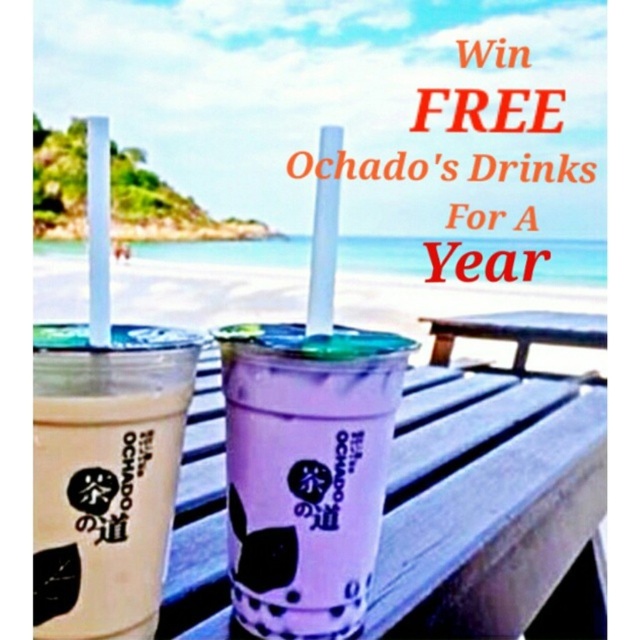
You are at a beach picnic and want to know which item is taller between the purple translucent cup at center and the wooden picnic table at center. According to the scene, which one is taller?

The purple translucent cup at center is taller than the wooden picnic table at center.

Looking at this image, you are standing in front of the wooden picnic table at center and want to grab the purple translucent cup at center. Can you reach it without moving your body?

The purple translucent cup at center is closer to the viewer than the wooden picnic table at center, so yes, you can reach it without moving your body since it is in front of the table.

Please look at the image of the Ochado contest advertisement. There are two cups on the wooden table. The cup on the left has a light colored beverage, and the cup on the right has a purple drink. Now, a point is marked at coordinates (305, 472). Which cup does this point indicate?

The point at (305, 472) marks the purple translucent cup at center.